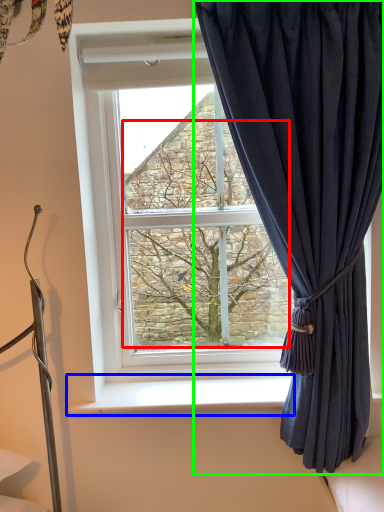
Question: Based on their relative distances, which object is farther from tree (highlighted by a red box)? Choose from window sill (highlighted by a blue box) and curtain (highlighted by a green box).

Choices:
 (A) window sill
 (B) curtain

Answer: (A)